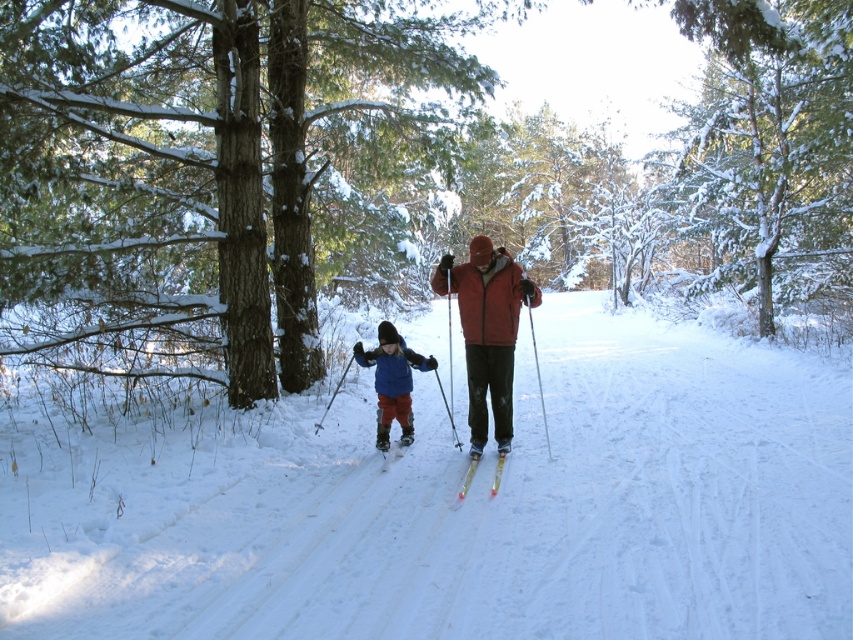
Does smooth bark tree at center have a lesser height compared to matte black ski at lower center?

Incorrect, smooth bark tree at center's height does not fall short of matte black ski at lower center's.

Does smooth bark tree at center have a smaller size compared to matte black ski at lower center?

No, smooth bark tree at center is not smaller than matte black ski at lower center.

The image size is (853, 640). What do you see at coordinates (202, 170) in the screenshot?
I see `smooth bark tree at center` at bounding box center [202, 170].

I want to click on smooth bark tree at center, so click(202, 170).

Which is below, white powdery snow at center or matte red jacket at center?

white powdery snow at center

Which is above, white powdery snow at center or matte red jacket at center?

matte red jacket at center is above.

Does point (611, 618) come closer to viewer compared to point (473, 268)?

Yes, it is in front of point (473, 268).

Find the location of a particular element. white powdery snow at center is located at coordinates [x=465, y=508].

What do you see at coordinates (392, 381) in the screenshot? The height and width of the screenshot is (640, 853). I see `blue fleece jacket at center` at bounding box center [392, 381].

The image size is (853, 640). What are the coordinates of `blue fleece jacket at center` in the screenshot? It's located at (392, 381).

The height and width of the screenshot is (640, 853). I want to click on blue fleece jacket at center, so click(x=392, y=381).